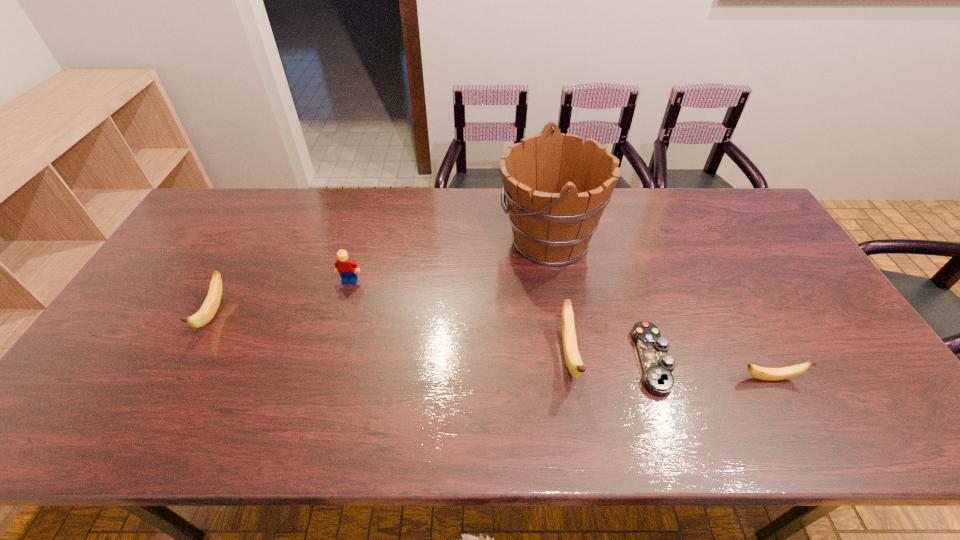
If we want them evenly spaced by inserting an extra banana among them, please locate a free spot for this new banana. Please provide its 2D coordinates. Your answer should be formatted as a tuple, i.e. [(x, y)], where the tuple contains the x and y coordinates of a point satisfying the conditions above.

[(384, 334)]